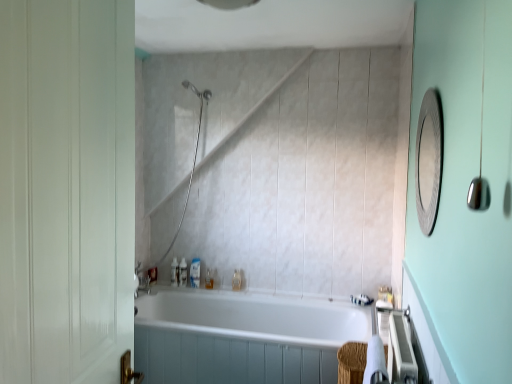
Question: Is translucent plastic soap dispenser at center, the fourth toiletry positioned from the left, in front of metallic textured mirror at upper right?

Choices:
 (A) no
 (B) yes

Answer: (A)

Question: Can you confirm if translucent plastic soap dispenser at center, the fourth toiletry positioned from the left, is positioned to the left of metallic textured mirror at upper right?

Choices:
 (A) no
 (B) yes

Answer: (B)

Question: Is translucent plastic soap dispenser at center, the 4th toiletry positioned from the right, smaller than metallic textured mirror at upper right?

Choices:
 (A) yes
 (B) no

Answer: (A)

Question: Is translucent plastic soap dispenser at center, the 4th toiletry positioned from the right, to the right of metallic textured mirror at upper right from the viewer's perspective?

Choices:
 (A) yes
 (B) no

Answer: (B)

Question: From a real-world perspective, does translucent plastic soap dispenser at center, the 4th toiletry positioned from the right, sit lower than metallic textured mirror at upper right?

Choices:
 (A) yes
 (B) no

Answer: (A)

Question: Choose the correct answer: Is translucent plastic soap at lower center, acting as the 5th toiletry starting from the left, inside translucent plastic bottle at lower center, arranged as the 2th toiletry when viewed from the right, or outside it?

Choices:
 (A) inside
 (B) outside

Answer: (B)

Question: Considering their positions, is translucent plastic soap at lower center, the third toiletry from the right, located in front of or behind translucent plastic bottle at lower center, arranged as the 2th toiletry when viewed from the right?

Choices:
 (A) front
 (B) behind

Answer: (B)

Question: In terms of width, does translucent plastic soap at lower center, the third toiletry from the right, look wider or thinner when compared to translucent plastic bottle at lower center, arranged as the 2th toiletry when viewed from the right?

Choices:
 (A) wide
 (B) thin

Answer: (A)

Question: From the image's perspective, is translucent plastic soap at lower center, the third toiletry from the right, positioned above or below translucent plastic bottle at lower center, which is the sixth toiletry in left-to-right order?

Choices:
 (A) below
 (B) above

Answer: (B)

Question: Is translucent plastic soap at upper left, which is the sixth toiletry from right to left, taller or shorter than translucent plastic bottle at lower center, which is the sixth toiletry in left-to-right order?

Choices:
 (A) short
 (B) tall

Answer: (B)

Question: Looking at their shapes, would you say translucent plastic soap at upper left, acting as the second toiletry starting from the left, is wider or thinner than translucent plastic bottle at lower center, arranged as the 2th toiletry when viewed from the right?

Choices:
 (A) wide
 (B) thin

Answer: (A)

Question: Considering the relative positions of translucent plastic soap at upper left, acting as the second toiletry starting from the left, and translucent plastic bottle at lower center, arranged as the 2th toiletry when viewed from the right, in the image provided, is translucent plastic soap at upper left, acting as the second toiletry starting from the left, to the left or to the right of translucent plastic bottle at lower center, arranged as the 2th toiletry when viewed from the right,?

Choices:
 (A) left
 (B) right

Answer: (A)

Question: From a real-world perspective, relative to translucent plastic bottle at lower center, which is the sixth toiletry in left-to-right order, is translucent plastic soap at upper left, which is the sixth toiletry from right to left, vertically above or below?

Choices:
 (A) above
 (B) below

Answer: (A)

Question: Considering their positions, is translucent plastic bottle at lower left, arranged as the seventh toiletry when viewed from the right, located in front of or behind translucent plastic bottle at lower center, arranged as the 2th toiletry when viewed from the right?

Choices:
 (A) behind
 (B) front

Answer: (A)

Question: Is point (150, 269) closer or farther from the camera than point (232, 284)?

Choices:
 (A) closer
 (B) farther

Answer: (A)